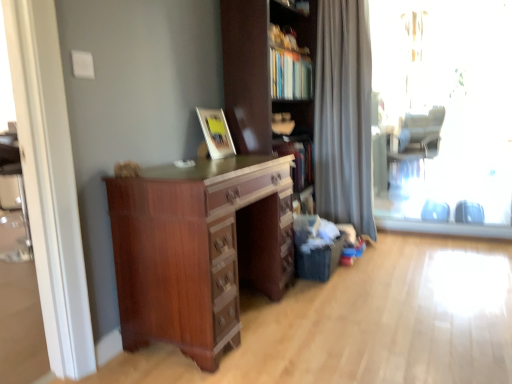
Question: Are transparent glass window at right and gray fabric swivel chair at right making contact?

Choices:
 (A) yes
 (B) no

Answer: (B)

Question: Is transparent glass window at right positioned in front of gray fabric swivel chair at right?

Choices:
 (A) yes
 (B) no

Answer: (A)

Question: Can you confirm if transparent glass window at right is wider than gray fabric swivel chair at right?

Choices:
 (A) no
 (B) yes

Answer: (A)

Question: Is transparent glass window at right taller than gray fabric swivel chair at right?

Choices:
 (A) yes
 (B) no

Answer: (A)

Question: Is transparent glass window at right further to camera compared to gray fabric swivel chair at right?

Choices:
 (A) no
 (B) yes

Answer: (A)

Question: Is transparent glass window at right aimed at gray fabric swivel chair at right?

Choices:
 (A) no
 (B) yes

Answer: (A)

Question: From the image's perspective, is matte brown cupboard at center on matte wooden picture frame at upper center?

Choices:
 (A) yes
 (B) no

Answer: (A)

Question: Is matte brown cupboard at center oriented away from matte wooden picture frame at upper center?

Choices:
 (A) no
 (B) yes

Answer: (A)

Question: Would you say matte wooden picture frame at upper center is part of matte brown cupboard at center's contents?

Choices:
 (A) no
 (B) yes

Answer: (A)

Question: Is matte brown cupboard at center facing towards matte wooden picture frame at upper center?

Choices:
 (A) yes
 (B) no

Answer: (B)

Question: Can you confirm if matte brown cupboard at center is taller than matte wooden picture frame at upper center?

Choices:
 (A) yes
 (B) no

Answer: (A)

Question: From the image's perspective, is matte brown cupboard at center under matte wooden picture frame at upper center?

Choices:
 (A) yes
 (B) no

Answer: (B)

Question: Is mahogany wood chest of drawers at center in front of matte wooden picture frame at upper center?

Choices:
 (A) no
 (B) yes

Answer: (B)